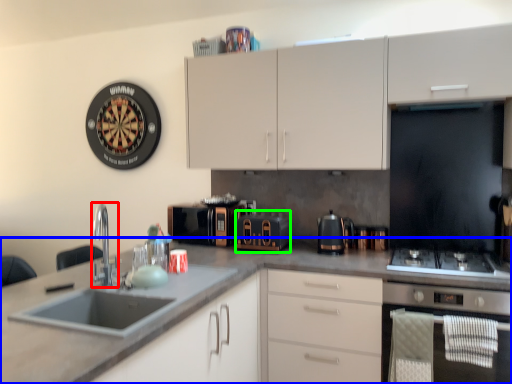
Question: Which is nearer to the tap (highlighted by a red box)? countertop (highlighted by a blue box) or appliance (highlighted by a green box).

Choices:
 (A) countertop
 (B) appliance

Answer: (A)